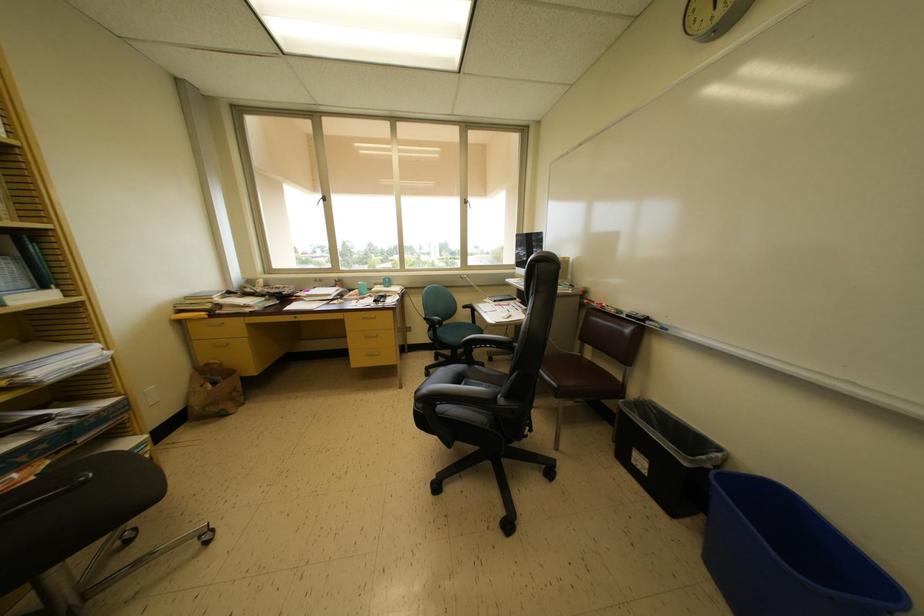
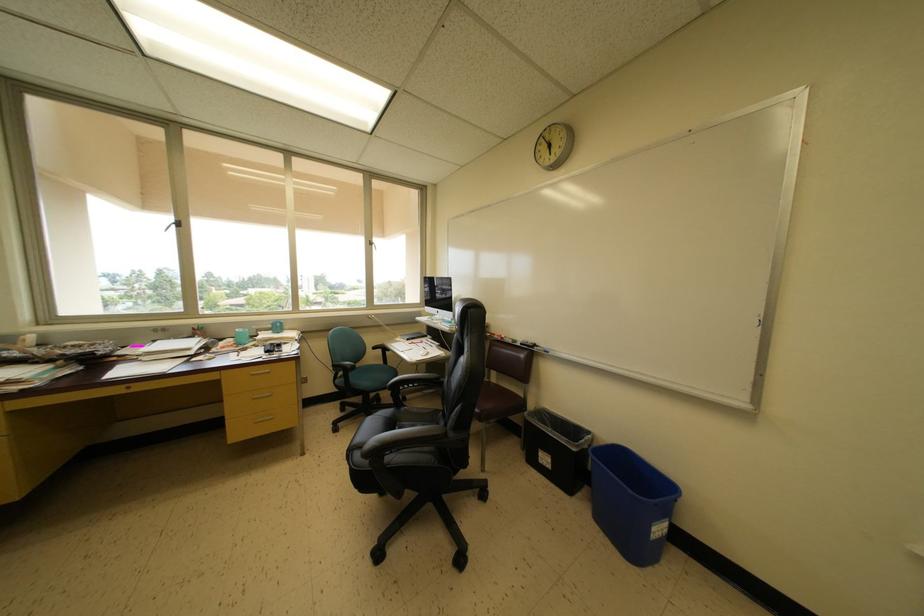
Locate, in the second image, the point that corresponds to point (480, 371) in the first image.

(408, 413)